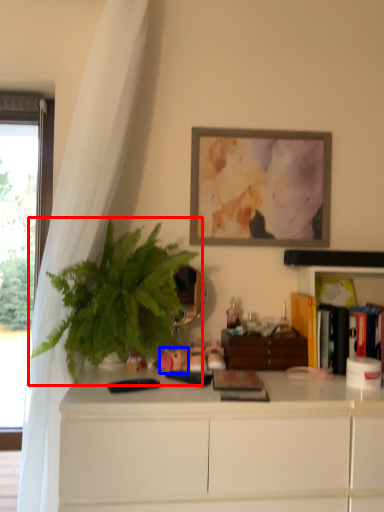
Question: Which of the following is the farthest to the observer, houseplant (highlighted by a red box) or toy (highlighted by a blue box)?

Choices:
 (A) houseplant
 (B) toy

Answer: (B)